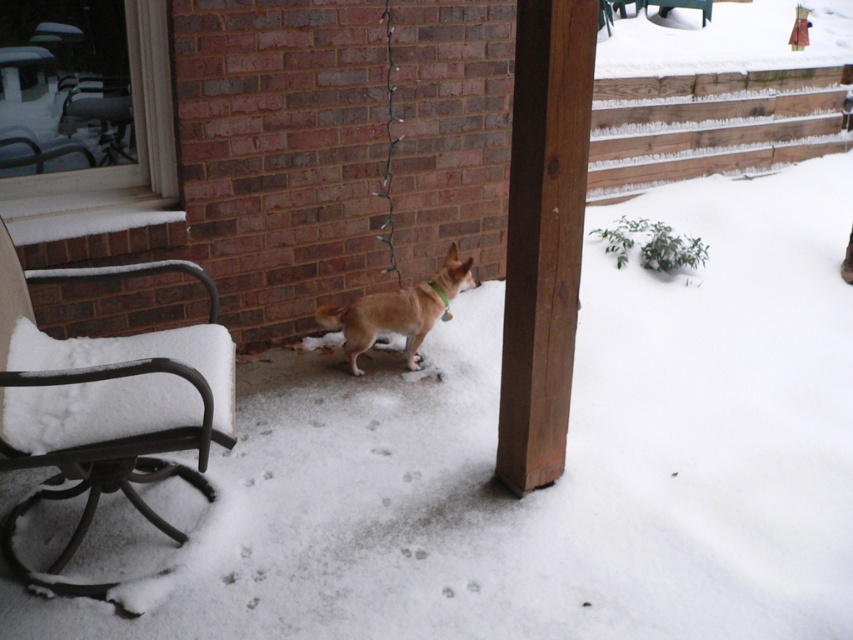
Question: Does metallic black chair at left have a lesser width compared to brown furry dog at center?

Choices:
 (A) no
 (B) yes

Answer: (A)

Question: Considering the relative positions of metallic black chair at left and brown furry dog at center in the image provided, where is metallic black chair at left located with respect to brown furry dog at center?

Choices:
 (A) right
 (B) left

Answer: (B)

Question: Can you confirm if metallic black chair at left is positioned to the right of brown furry dog at center?

Choices:
 (A) no
 (B) yes

Answer: (A)

Question: Which point appears closest to the camera in this image?

Choices:
 (A) (421, 321)
 (B) (109, 492)

Answer: (B)